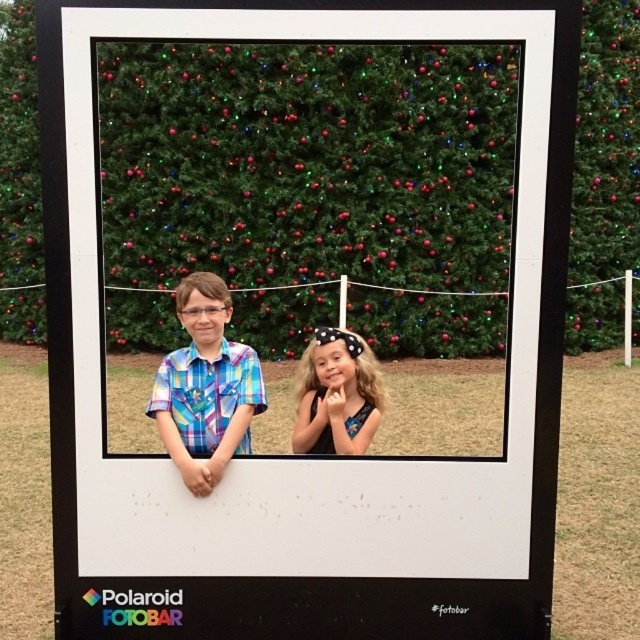
Question: Which of the following is the farthest from the observer?

Choices:
 (A) (260, 406)
 (B) (346, 385)

Answer: (B)

Question: Which object is farther from the camera taking this photo?

Choices:
 (A) plaid fabric shirt at center
 (B) blonde hair at center

Answer: (B)

Question: Does plaid fabric shirt at center come in front of blonde hair at center?

Choices:
 (A) yes
 (B) no

Answer: (A)

Question: Can you confirm if plaid fabric shirt at center is bigger than blonde hair at center?

Choices:
 (A) no
 (B) yes

Answer: (B)

Question: From the image, what is the correct spatial relationship of plaid fabric shirt at center in relation to blonde hair at center?

Choices:
 (A) above
 (B) below

Answer: (A)